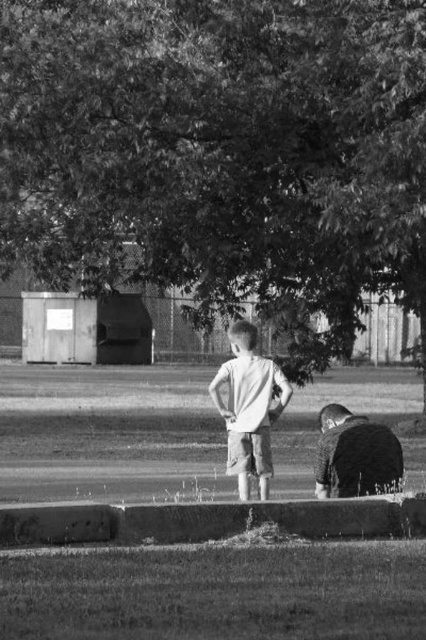
Based on the photo, you are standing at the point marked by the coordinates point (x=219, y=150) in the image. What object is directly in front of you?

The dark green leafy tree at center is directly in front of you at point (x=219, y=150).

The scene shows a dark green leafy tree at center and a concrete curb at lower center. Which of these two objects takes up more space in the image?

The concrete curb at lower center takes up more space in the image than the dark green leafy tree at center.

You are a gardener standing at the edge of the concrete curb at lower center. You want to water the dark green leafy tree at center. Can you reach the tree with your hose without moving the hose nozzle? Please explain your reasoning based on their positions.

The dark green leafy tree at center is above the concrete curb at lower center, so the tree is positioned higher than the curb. Since the gardener is at the curb, they can likely reach the tree with the hose as it is above them, but the exact distance isn